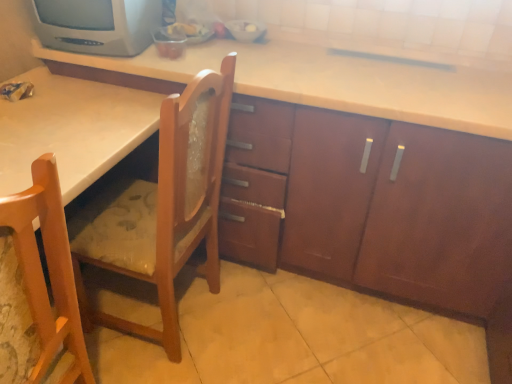
Question: Is light brown wood chair at lower left, acting as the 1th chair starting from the front, taller or shorter than wooden chair at center, acting as the 2th chair starting from the front?

Choices:
 (A) short
 (B) tall

Answer: (A)

Question: From the image's perspective, relative to wooden chair at center, which is the first chair from back to front, is light brown wood chair at lower left, acting as the 1th chair starting from the front, above or below?

Choices:
 (A) below
 (B) above

Answer: (A)

Question: Which object is positioned farthest from the wooden chair at center, acting as the 2th chair starting from the front?

Choices:
 (A) light brown wood chair at lower left, acting as the 1th chair starting from the front
 (B) matte gray crt tv at upper left

Answer: (B)

Question: Based on their relative distances, which object is nearer to the wooden chair at center, which is the first chair from back to front?

Choices:
 (A) light brown wood chair at lower left, acting as the 1th chair starting from the front
 (B) matte gray crt tv at upper left

Answer: (A)